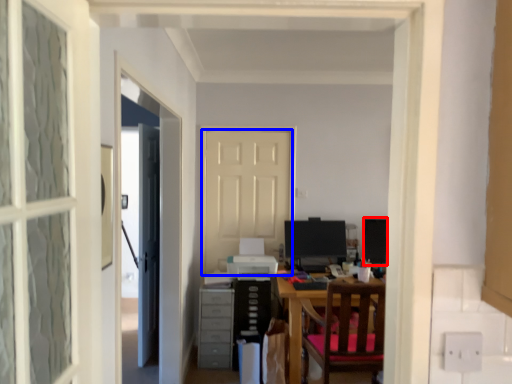
Question: Which object appears farthest to the camera in this image, computer monitor (highlighted by a red box) or door (highlighted by a blue box)?

Choices:
 (A) computer monitor
 (B) door

Answer: (B)